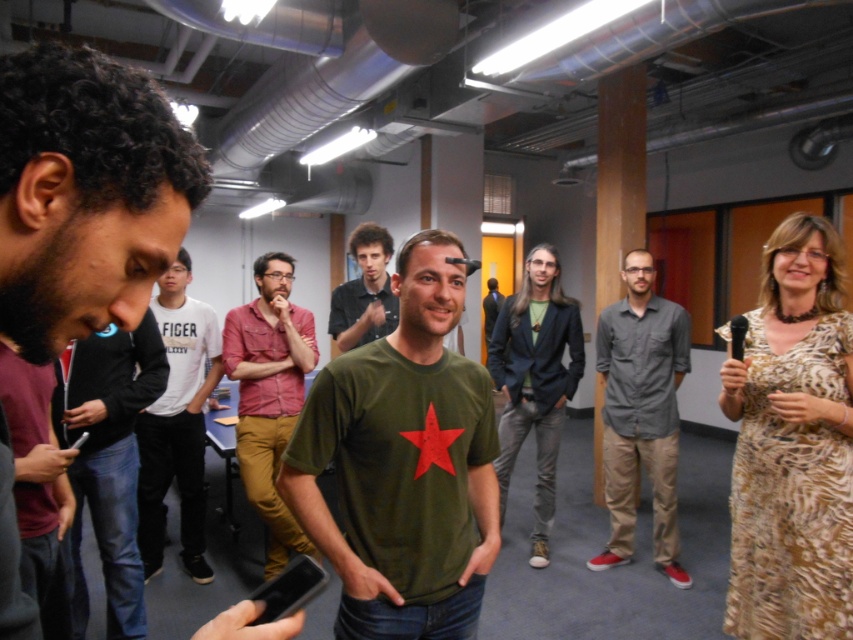
You are a photographer trying to capture a group photo. You notice the black matte jacket at left and the denim shirt at center in your frame. Based on their heights in the image, which one should you adjust to ensure both are fully visible in the photo?

The black matte jacket at left is shorter than the denim shirt at center, so you should lower the camera angle slightly to ensure the shorter black matte jacket at left is fully visible while still capturing the taller denim shirt at center.